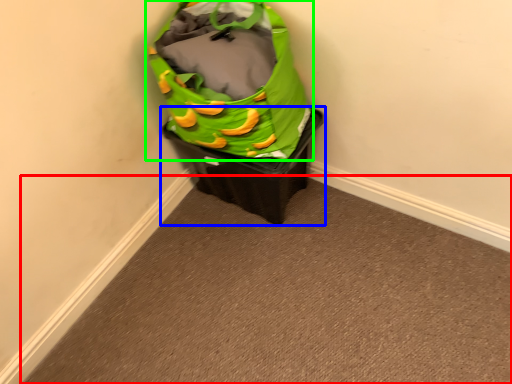
Question: Which object is positioned closest to plain (highlighted by a red box)? Select from waste container (highlighted by a blue box) and luggage and bags (highlighted by a green box).

Choices:
 (A) waste container
 (B) luggage and bags

Answer: (A)